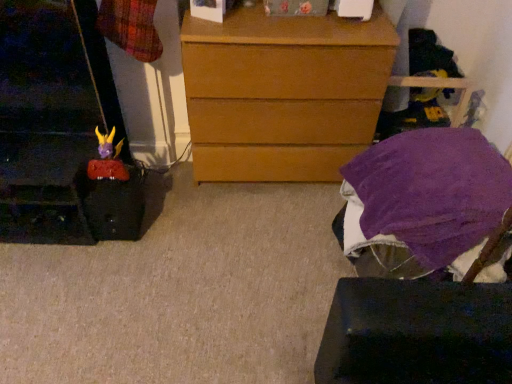
Question: From a real-world perspective, relative to purple soft fabric at lower right, is purple fabric-covered stool at lower right vertically above or below?

Choices:
 (A) above
 (B) below

Answer: (B)

Question: Choose the correct answer: Is purple fabric-covered stool at lower right inside purple soft fabric at lower right or outside it?

Choices:
 (A) inside
 (B) outside

Answer: (B)

Question: Which object is positioned farthest from the wooden chest of drawers at center?

Choices:
 (A) purple soft fabric at lower right
 (B) purple fabric-covered stool at lower right
 (C) matte plastic toy at left

Answer: (C)

Question: Based on their relative distances, which object is farther from the wooden chest of drawers at center?

Choices:
 (A) matte plastic toy at left
 (B) purple fabric-covered stool at lower right
 (C) purple soft fabric at lower right

Answer: (A)